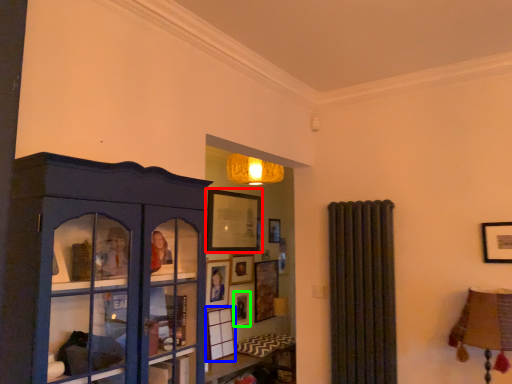
Question: Considering the real-world distances, which object is farthest from picture frame (highlighted by a red box)? picture frame (highlighted by a blue box) or picture frame (highlighted by a green box)?

Choices:
 (A) picture frame
 (B) picture frame

Answer: (A)